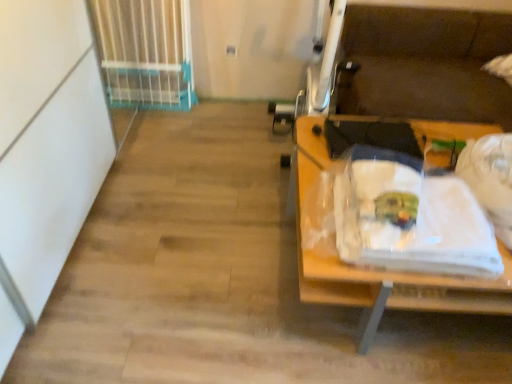
You are a GUI agent. You are given a task and a screenshot of the screen. Output one action in this format:
    pyautogui.click(x=<x>, y=<y>)
    Task: Click on the free point to the left of wooden desk at right
    This screenshot has width=512, height=384.
    Given the screenshot: What is the action you would take?
    pyautogui.click(x=202, y=261)